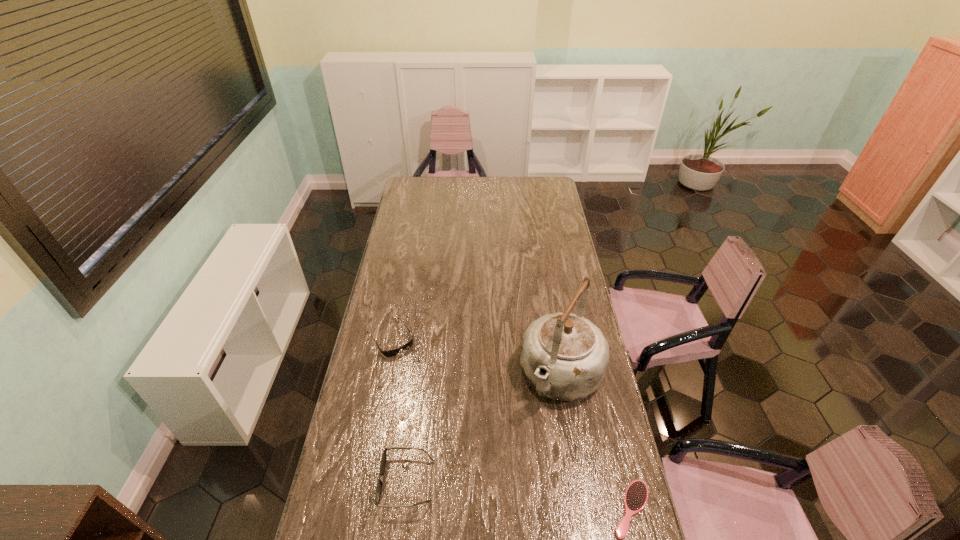
Find the location of a particular element. This screenshot has width=960, height=540. vacant space that's between the farther sunglasses and the kettle is located at coordinates (476, 356).

Locate an element on the screen. Image resolution: width=960 pixels, height=540 pixels. free point between the kettle and the nearer sunglasses is located at coordinates (484, 428).

Locate which object is the third closest to the hairbrush. Please provide its 2D coordinates. Your answer should be formatted as a tuple, i.e. [(x, y)], where the tuple contains the x and y coordinates of a point satisfying the conditions above.

[(389, 353)]

Identify which object is the second closest to the farther sunglasses. Please provide its 2D coordinates. Your answer should be formatted as a tuple, i.e. [(x, y)], where the tuple contains the x and y coordinates of a point satisfying the conditions above.

[(564, 356)]

Locate an element on the screen. free space in the image that satisfies the following two spatial constraints: 1. on the front side of the kettle; 2. on the left side of the farther sunglasses is located at coordinates (383, 375).

Image resolution: width=960 pixels, height=540 pixels. In order to click on free space that satisfies the following two spatial constraints: 1. on the front side of the farther sunglasses; 2. on the right side of the kettle in this screenshot , I will do `click(383, 375)`.

Locate an element on the screen. free space that satisfies the following two spatial constraints: 1. on the front side of the farther sunglasses; 2. on the left side of the hairbrush is located at coordinates (357, 509).

I want to click on blank space that satisfies the following two spatial constraints: 1. on the front side of the farther sunglasses; 2. on the front-facing side of the nearer sunglasses, so click(363, 481).

The height and width of the screenshot is (540, 960). Identify the location of free region that satisfies the following two spatial constraints: 1. on the front side of the farther sunglasses; 2. on the front-facing side of the nearer sunglasses. (363, 481).

Locate an element on the screen. Image resolution: width=960 pixels, height=540 pixels. vacant space that satisfies the following two spatial constraints: 1. on the front side of the farther sunglasses; 2. on the front-facing side of the nearer sunglasses is located at coordinates (363, 481).